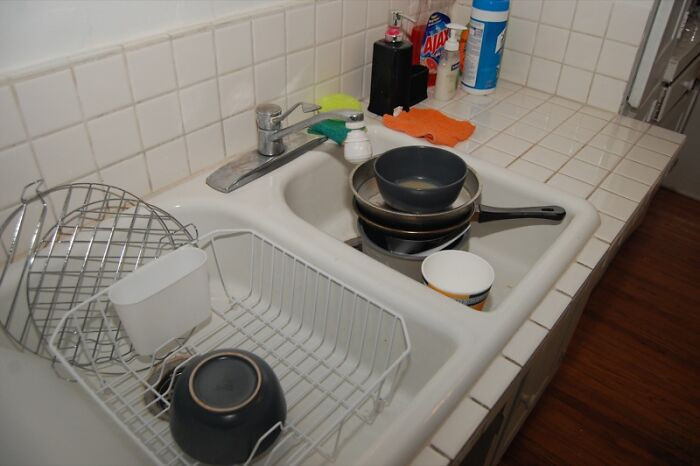
I want to click on tile, so click(x=195, y=85).